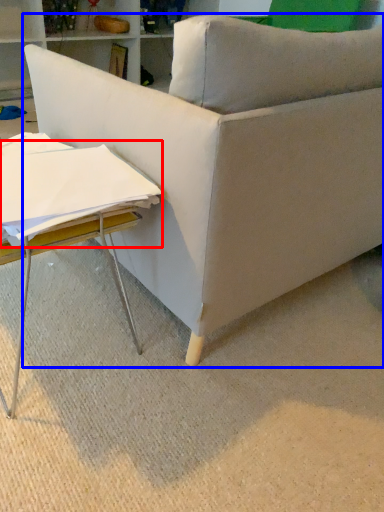
Question: Which of the following is the closest to the observer, sheet (highlighted by a red box) or studio couch (highlighted by a blue box)?

Choices:
 (A) sheet
 (B) studio couch

Answer: (B)